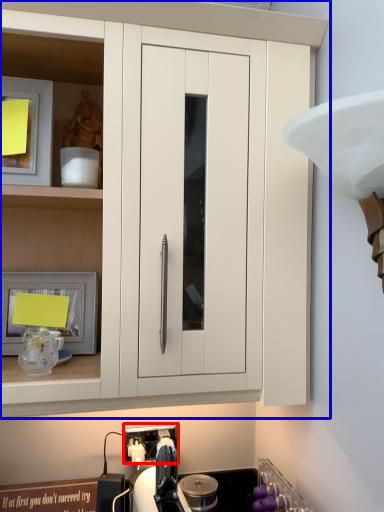
Question: Which object is further to the camera taking this photo, electric outlet (highlighted by a red box) or cabinetry (highlighted by a blue box)?

Choices:
 (A) electric outlet
 (B) cabinetry

Answer: (A)